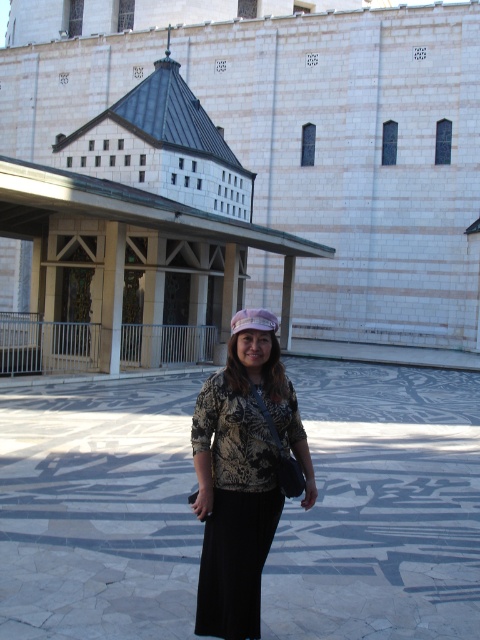
Question: Is printed fabric blouse at center further to camera compared to matte pink fabric hat at center?

Choices:
 (A) no
 (B) yes

Answer: (A)

Question: Which point is farther to the camera?

Choices:
 (A) (252, 310)
 (B) (231, 406)

Answer: (A)

Question: Considering the relative positions of printed fabric blouse at center and matte pink fabric hat at center in the image provided, where is printed fabric blouse at center located with respect to matte pink fabric hat at center?

Choices:
 (A) left
 (B) right

Answer: (B)

Question: Is printed fabric blouse at center above matte pink fabric hat at center?

Choices:
 (A) no
 (B) yes

Answer: (A)

Question: Among these objects, which one is farthest from the camera?

Choices:
 (A) matte pink fabric hat at center
 (B) printed fabric blouse at center

Answer: (A)